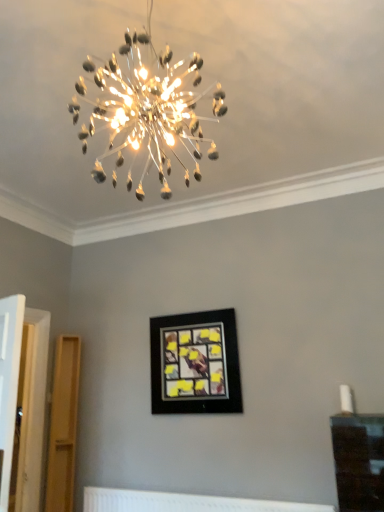
Question: Is black matte picture frame at center outside of clear glass chandelier at upper center?

Choices:
 (A) yes
 (B) no

Answer: (A)

Question: Is black matte picture frame at center facing towards clear glass chandelier at upper center?

Choices:
 (A) no
 (B) yes

Answer: (B)

Question: Considering the relative positions of black matte picture frame at center and clear glass chandelier at upper center in the image provided, is black matte picture frame at center to the right of clear glass chandelier at upper center from the viewer's perspective?

Choices:
 (A) yes
 (B) no

Answer: (A)

Question: Is the depth of black matte picture frame at center greater than that of clear glass chandelier at upper center?

Choices:
 (A) no
 (B) yes

Answer: (B)

Question: Can you confirm if black matte picture frame at center is smaller than clear glass chandelier at upper center?

Choices:
 (A) no
 (B) yes

Answer: (B)

Question: Is black matte picture frame at center in contact with clear glass chandelier at upper center?

Choices:
 (A) yes
 (B) no

Answer: (B)

Question: Are clear glass chandelier at upper center and black matte picture frame at center far apart?

Choices:
 (A) yes
 (B) no

Answer: (A)

Question: From a real-world perspective, is clear glass chandelier at upper center under black matte picture frame at center?

Choices:
 (A) no
 (B) yes

Answer: (A)

Question: Considering the relative sizes of clear glass chandelier at upper center and black matte picture frame at center in the image provided, is clear glass chandelier at upper center taller than black matte picture frame at center?

Choices:
 (A) no
 (B) yes

Answer: (B)

Question: Could you tell me if clear glass chandelier at upper center is turned towards black matte picture frame at center?

Choices:
 (A) yes
 (B) no

Answer: (B)

Question: From the image's perspective, would you say clear glass chandelier at upper center is shown under black matte picture frame at center?

Choices:
 (A) no
 (B) yes

Answer: (A)

Question: Considering the relative sizes of clear glass chandelier at upper center and black matte picture frame at center in the image provided, is clear glass chandelier at upper center shorter than black matte picture frame at center?

Choices:
 (A) yes
 (B) no

Answer: (B)

Question: From the image's perspective, would you say clear glass chandelier at upper center is positioned over white textured radiator at lower center?

Choices:
 (A) no
 (B) yes

Answer: (B)